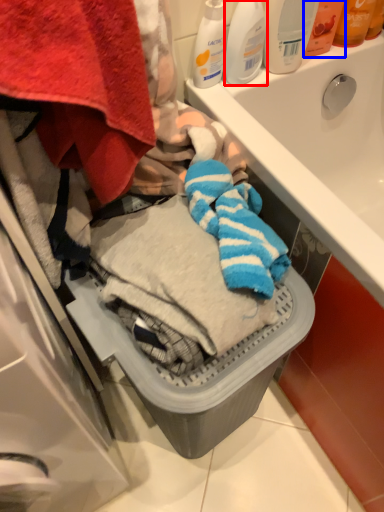
Question: Among these objects, which one is farthest to the camera, cleaning product (highlighted by a red box) or toiletry (highlighted by a blue box)?

Choices:
 (A) cleaning product
 (B) toiletry

Answer: (B)